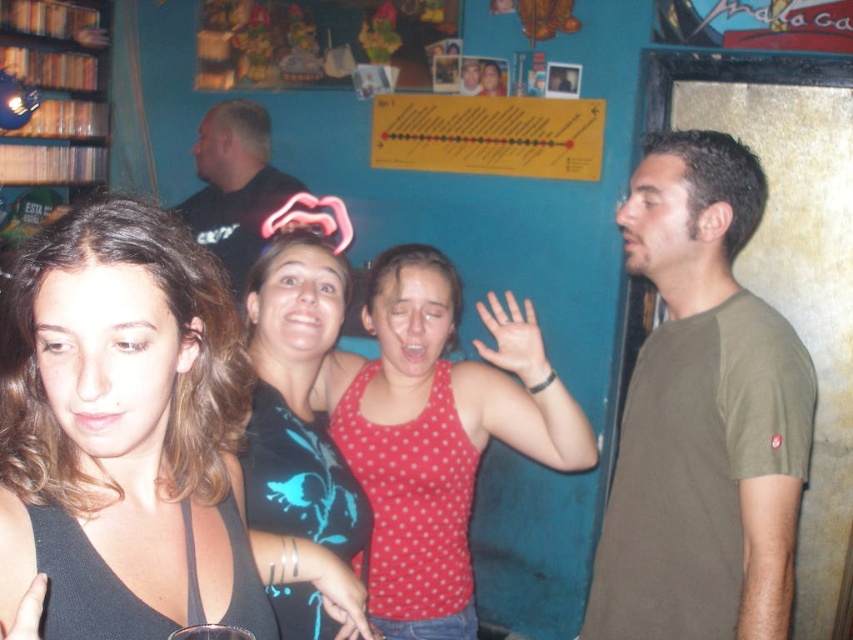
Does black matte tank top at left appear on the left side of polka dot tank top at center?

Indeed, black matte tank top at left is positioned on the left side of polka dot tank top at center.

The height and width of the screenshot is (640, 853). In order to click on black matte tank top at left in this screenshot , I will do `click(122, 429)`.

Image resolution: width=853 pixels, height=640 pixels. What are the coordinates of `black matte tank top at left` in the screenshot? It's located at (122, 429).

Is green cotton t-shirt at right shorter than red polka dot tank top at center?

No.

Who is shorter, green cotton t-shirt at right or red polka dot tank top at center?

red polka dot tank top at center

This screenshot has height=640, width=853. I want to click on green cotton t-shirt at right, so click(x=701, y=416).

This screenshot has height=640, width=853. Identify the location of green cotton t-shirt at right. (701, 416).

What do you see at coordinates (122, 429) in the screenshot? Image resolution: width=853 pixels, height=640 pixels. I see `black matte tank top at left` at bounding box center [122, 429].

You are a GUI agent. You are given a task and a screenshot of the screen. Output one action in this format:
    pyautogui.click(x=<x>, y=<y>)
    Task: Click on the black matte tank top at left
    The height and width of the screenshot is (640, 853).
    Given the screenshot: What is the action you would take?
    pyautogui.click(x=122, y=429)

This screenshot has width=853, height=640. Find the location of `black matte tank top at left`. black matte tank top at left is located at coordinates (122, 429).